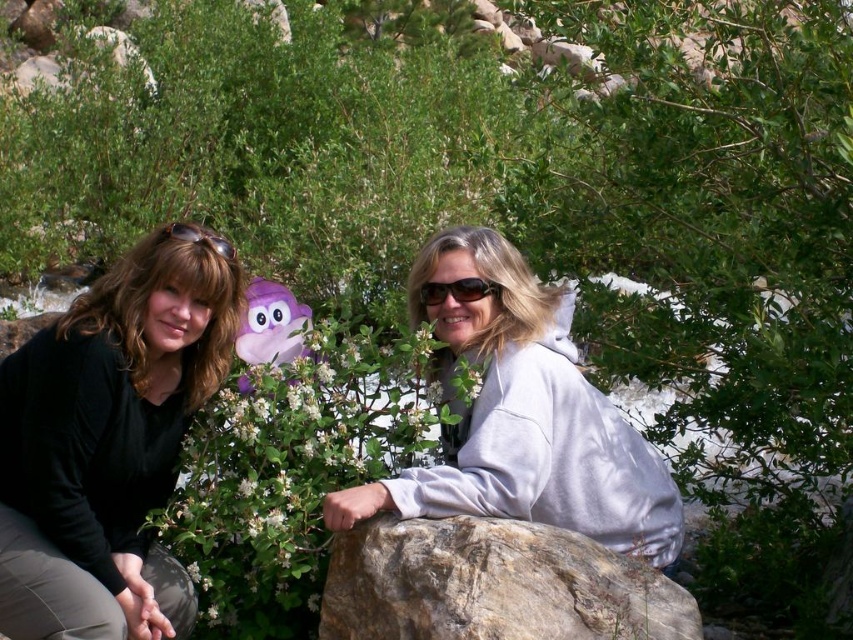
Based on the scene description, which object is smaller between the black matte shirt at lower left and the white fleece jacket at center?

The black matte shirt at lower left is smaller than the white fleece jacket at center according to the description.

You are a photographer trying to capture a closeup of the purple plush toy at center and sunglasses at center. Which object should you zoom in on to ensure it fills the frame more? Explain your reasoning based on their sizes.

The purple plush toy at center is bigger than the sunglasses at center, so you should zoom in on the purple plush toy at center to ensure it fills the frame more.